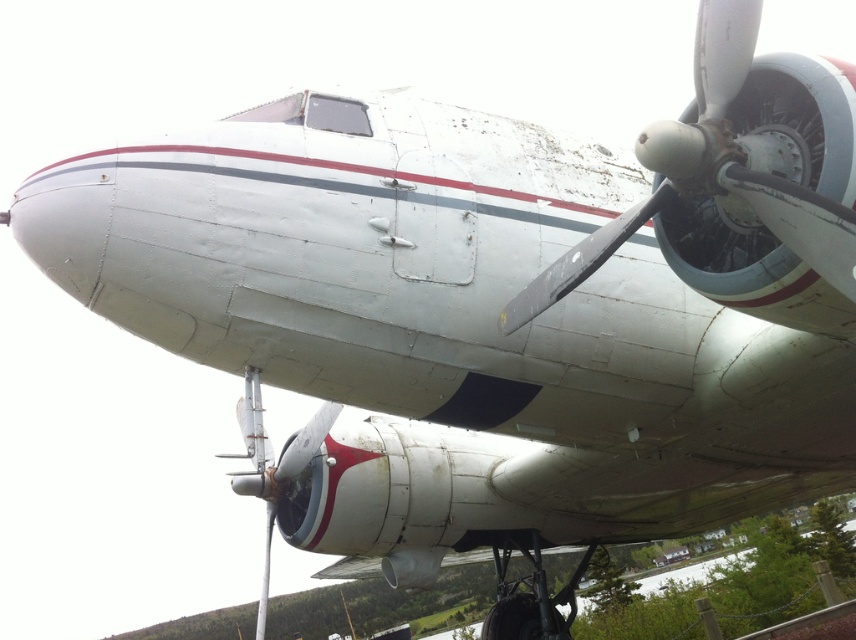
You are a museum guide explaining the vintage aircraft to visitors. You point to the white matte propeller at center and the silver metallic propeller at center. Which propeller is closer to the visitors?

The white matte propeller at center is closer to the visitors because it is in front of the silver metallic propeller at center.

You are a maintenance worker inspecting the vintage aircraft. You notice two propellers at the center of the aircraft. Which propeller is positioned higher, the white matte propeller at center or the silver metallic propeller at center?

The white matte propeller at center is located above the silver metallic propeller at center, so it is positioned higher.